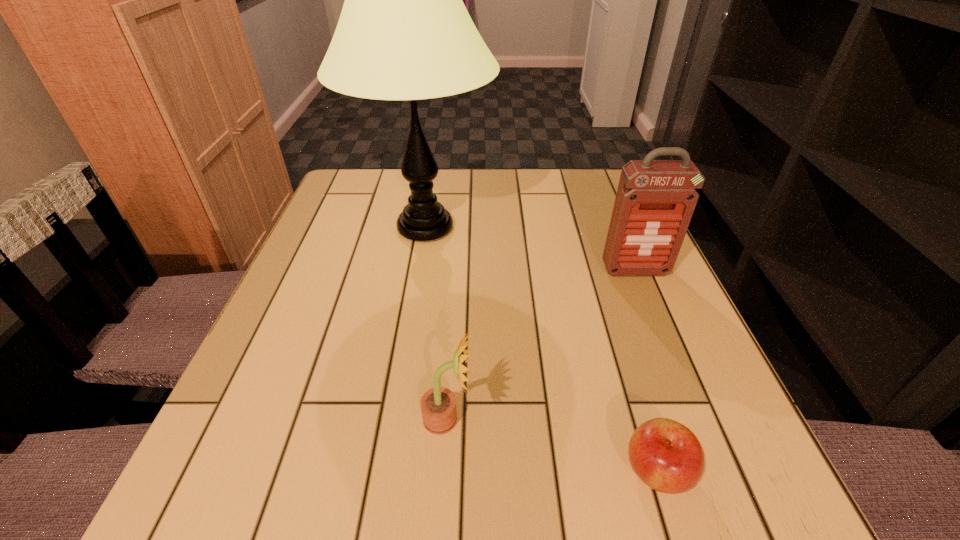
You are a GUI agent. You are given a task and a screenshot of the screen. Output one action in this format:
    pyautogui.click(x=<x>, y=<y>)
    Task: Click on the lamp
    
    Given the screenshot: What is the action you would take?
    [x=404, y=33]

This screenshot has width=960, height=540. Find the location of `the first-aid kit`. the first-aid kit is located at coordinates (655, 200).

This screenshot has width=960, height=540. I want to click on the third tallest object, so click(438, 405).

Identify the location of the shortest object. (667, 456).

Locate an element on the screen. vacant area situated on the right of the lamp is located at coordinates (588, 227).

Where is `vacant space situated 0.120m on the front-facing side of the first-aid kit`? The width and height of the screenshot is (960, 540). vacant space situated 0.120m on the front-facing side of the first-aid kit is located at coordinates (656, 320).

You are a GUI agent. You are given a task and a screenshot of the screen. Output one action in this format:
    pyautogui.click(x=<x>, y=<y>)
    Task: Click on the free space located on the face of the second shortest object
    
    Given the screenshot: What is the action you would take?
    pyautogui.click(x=586, y=420)

The image size is (960, 540). What are the coordinates of `free region located on the back of the apple` in the screenshot? It's located at (611, 319).

Identify the location of object that is at the far edge. (404, 33).

What are the coordinates of `object at the near edge` in the screenshot? It's located at (667, 456).